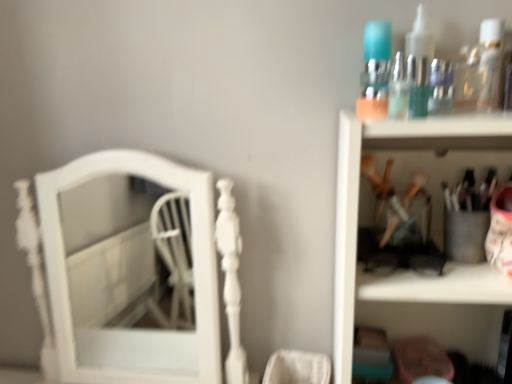
Question: Is translucent glass bottles at upper right at the right side of metallic silver utensils at upper right?

Choices:
 (A) yes
 (B) no

Answer: (B)

Question: Is translucent glass bottles at upper right behind metallic silver utensils at upper right?

Choices:
 (A) no
 (B) yes

Answer: (B)

Question: Considering the relative sizes of translucent glass bottles at upper right and metallic silver utensils at upper right in the image provided, is translucent glass bottles at upper right smaller than metallic silver utensils at upper right?

Choices:
 (A) yes
 (B) no

Answer: (A)

Question: Considering the relative positions of translucent glass bottles at upper right and metallic silver utensils at upper right in the image provided, is translucent glass bottles at upper right to the left of metallic silver utensils at upper right from the viewer's perspective?

Choices:
 (A) no
 (B) yes

Answer: (B)

Question: Is translucent glass bottles at upper right taller than metallic silver utensils at upper right?

Choices:
 (A) yes
 (B) no

Answer: (B)

Question: Can you confirm if translucent glass bottles at upper right is bigger than metallic silver utensils at upper right?

Choices:
 (A) no
 (B) yes

Answer: (A)

Question: Considering the relative sizes of clear plastic bottle at upper right and white glossy mirror at left in the image provided, is clear plastic bottle at upper right wider than white glossy mirror at left?

Choices:
 (A) yes
 (B) no

Answer: (B)

Question: Is clear plastic bottle at upper right positioned behind white glossy mirror at left?

Choices:
 (A) yes
 (B) no

Answer: (B)

Question: From a real-world perspective, is clear plastic bottle at upper right over white glossy mirror at left?

Choices:
 (A) no
 (B) yes

Answer: (B)

Question: From the image's perspective, is clear plastic bottle at upper right on white glossy mirror at left?

Choices:
 (A) yes
 (B) no

Answer: (A)

Question: Considering the relative positions of clear plastic bottle at upper right and white glossy mirror at left in the image provided, is clear plastic bottle at upper right to the right of white glossy mirror at left from the viewer's perspective?

Choices:
 (A) yes
 (B) no

Answer: (A)

Question: Does clear plastic bottle at upper right have a greater height compared to white glossy mirror at left?

Choices:
 (A) yes
 (B) no

Answer: (B)

Question: Does clear plastic bottle at upper right come in front of metallic silver utensils at upper right?

Choices:
 (A) no
 (B) yes

Answer: (A)